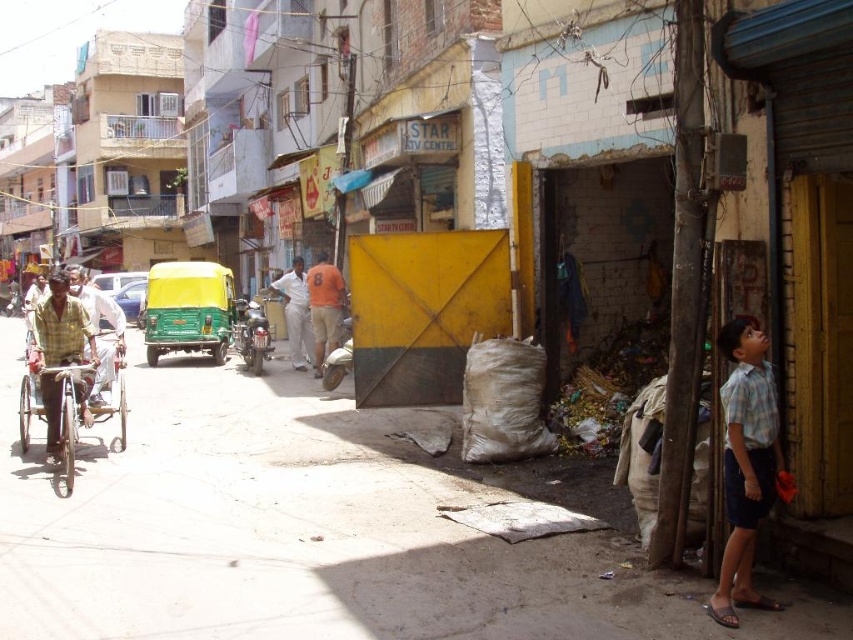
Does wooden brown cart at left have a smaller size compared to yellow fabric cart at left?

Indeed, wooden brown cart at left has a smaller size compared to yellow fabric cart at left.

Is point (119, 392) positioned in front of point (109, 308)?

Yes, point (119, 392) is closer to viewer.

The image size is (853, 640). What do you see at coordinates (59, 408) in the screenshot?
I see `wooden brown cart at left` at bounding box center [59, 408].

This screenshot has height=640, width=853. I want to click on wooden brown cart at left, so 59,408.

Does point (61, 440) come farther from viewer compared to point (310, 355)?

No, (61, 440) is in front of (310, 355).

The image size is (853, 640). What are the coordinates of `wooden brown cart at left` in the screenshot? It's located at (59, 408).

Between point (212, 307) and point (83, 301), which one is positioned in front?

Positioned in front is point (83, 301).

Can you confirm if green matte auto-rickshaw at center-left is positioned above yellow fabric cart at left?

Incorrect, green matte auto-rickshaw at center-left is not positioned above yellow fabric cart at left.

Which is behind, point (149, 317) or point (117, 326)?

The point (149, 317) is behind.

Where is `green matte auto-rickshaw at center-left`? This screenshot has height=640, width=853. green matte auto-rickshaw at center-left is located at coordinates (189, 308).